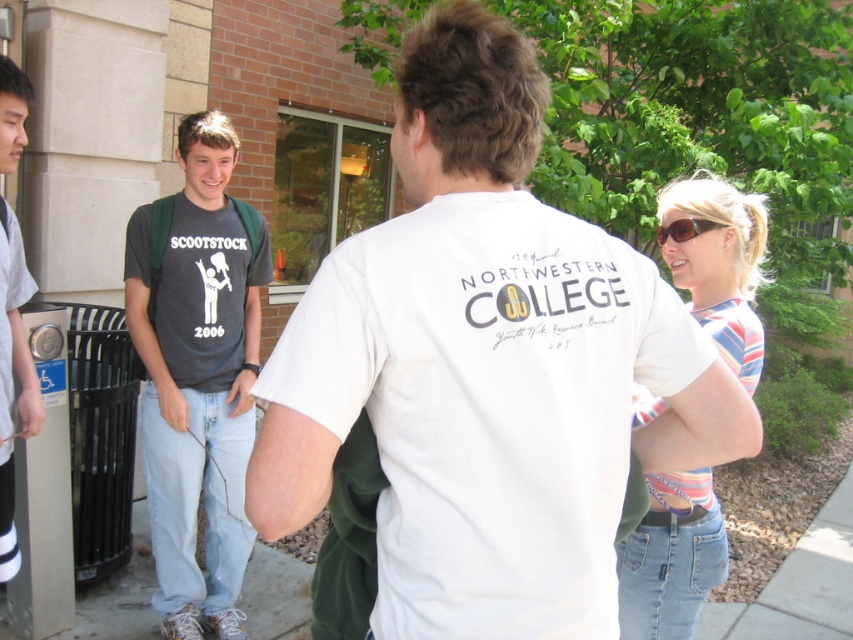
Between point (190, 483) and point (677, 218), which one is positioned in front?

Point (677, 218) is more forward.

Looking at this image, does dark gray t-shirt at center lie behind brown matte sunglasses at upper right?

Yes, it is.

The width and height of the screenshot is (853, 640). What are the coordinates of `dark gray t-shirt at center` in the screenshot? It's located at (196, 374).

Identify the location of dark gray t-shirt at center. The height and width of the screenshot is (640, 853). (196, 374).

Can you confirm if gray cotton shirt at left is smaller than brown matte sunglasses at upper right?

No, gray cotton shirt at left is not smaller than brown matte sunglasses at upper right.

Is point (16, 371) more distant than point (714, 221)?

Yes, it is behind point (714, 221).

At what (x,y) coordinates should I click in order to perform the action: click on gray cotton shirt at left. Please return your answer as a coordinate pair (x, y). This screenshot has width=853, height=640. Looking at the image, I should click on (13, 380).

Who is positioned more to the right, white cotton t-shirt at center or brown matte sunglasses at upper right?

Positioned to the right is brown matte sunglasses at upper right.

Find the location of a particular element. The width and height of the screenshot is (853, 640). white cotton t-shirt at center is located at coordinates (486, 365).